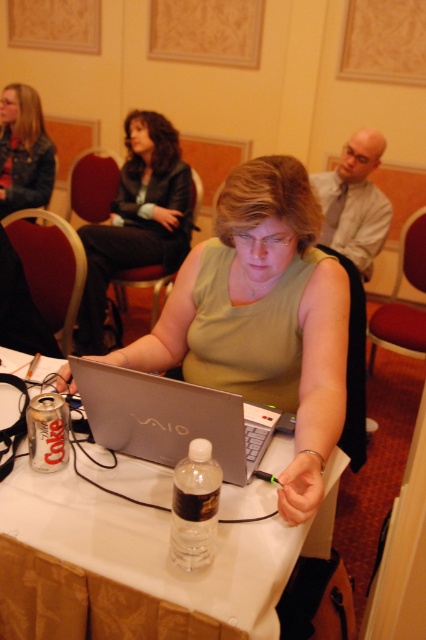
You are organizing a conference and need to ensure that the matte silver laptop at center and the silver metallic laptop at center can both fit on a table that has a maximum width of 1.2 meters. Given their sizes, will they fit side by side?

The matte silver laptop at center is larger in size than silver metallic laptop at center. However, without specific measurements, it is impossible to determine if their combined width exceeds the table

You are sitting at the table and want to reach both the point at coordinates point (276, 600) and the point at coordinates point (101, 252). Which point will you reach first if you extend your hand straight out?

You will reach the point at coordinates point (276, 600) first because it is closer to you than the other point.

You are attending a conference and notice a white plastic table at center and a green matte shirt at center. Which object is closer to the viewer?

The green matte shirt at center is closer to the viewer because the white plastic table at center is positioned under it.